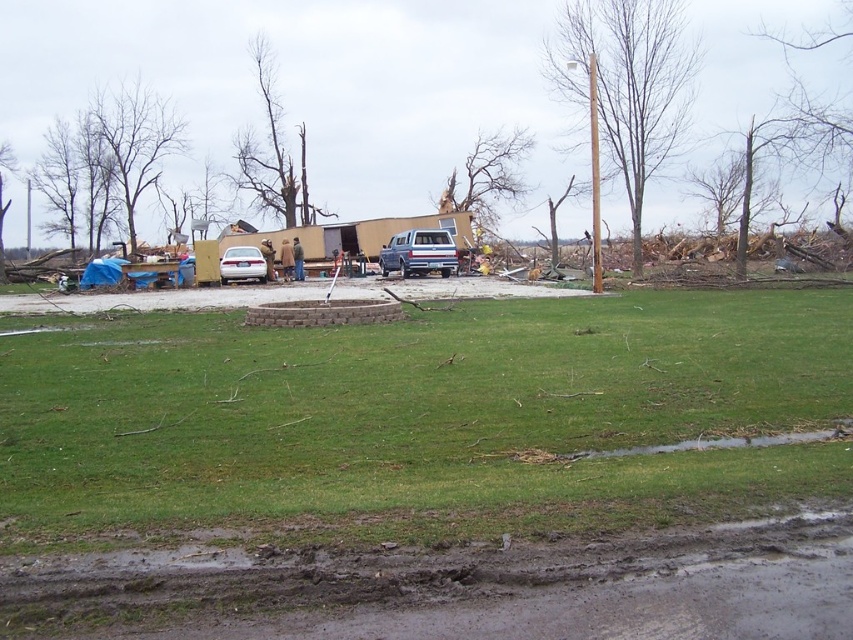
Consider the image. You are a rescue worker trying to reach the damaged yellow trailer. You need to cross the area between the muddy dirt at lower center and the silver metallic sedan at center. Considering the muddy dirt is smaller in size, will it be easier to navigate around it?

The muddy dirt at lower center is smaller in size compared to the silver metallic sedan at center, so it will be easier to navigate around the muddy dirt since it takes up less space.

You are standing in the disaster area and need to reach the silver metallic sedan at center to retrieve emergency supplies. Given that the green grass at center is in your path, can you walk around it to reach the sedan?

The green grass at center is closer to the viewer than the silver metallic sedan at center, so you can walk around the green grass at center to reach the silver metallic sedan at center.

You are a rescue worker trying to reach the collapsed yellow trailer. You have to decide whether to walk through the green grass at center or around the blue metallic truck at center. Which path is shorter?

The green grass at center is to the right of blue metallic truck at center, so walking through the green grass at center would be shorter as it is closer to the collapsed yellow trailer.